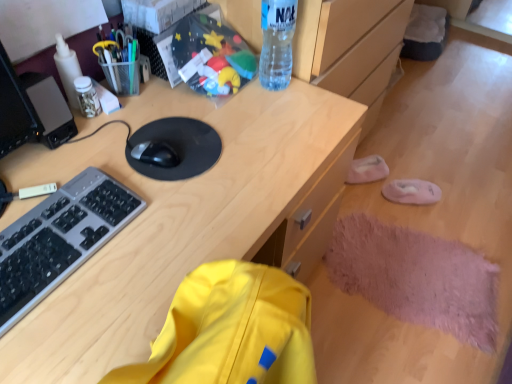
The image size is (512, 384). Identify the location of free point behind black matte mouse at center. (165, 112).